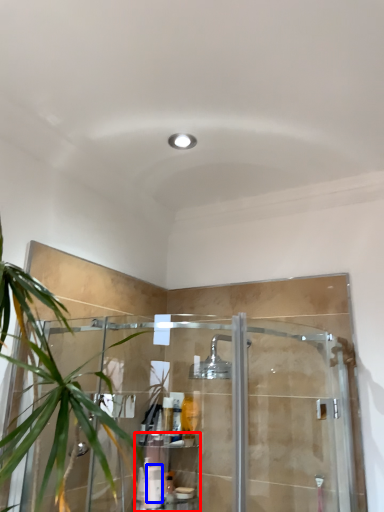
Question: Which point is closer to the camera, shelf (highlighted by a red box) or toiletry (highlighted by a blue box)?

Choices:
 (A) shelf
 (B) toiletry

Answer: (A)